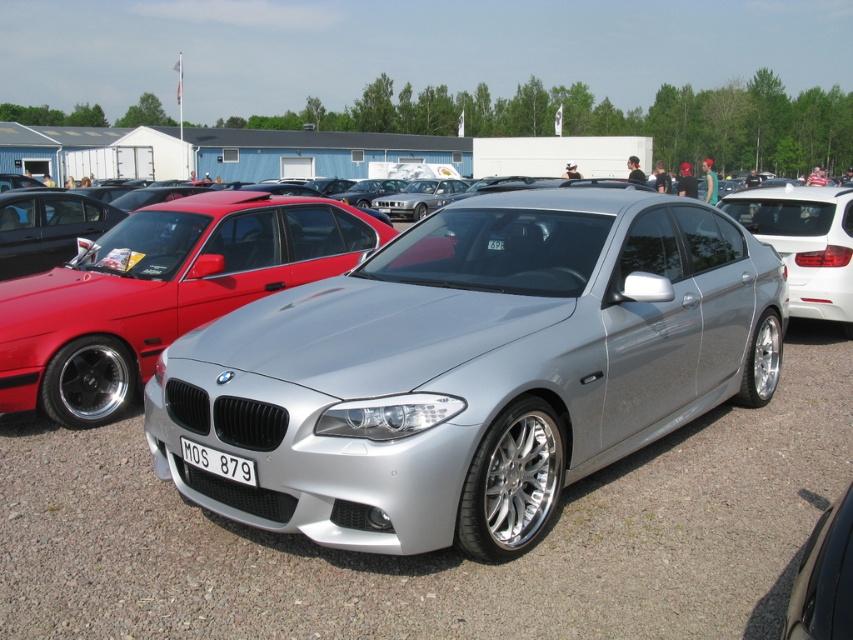
You are a photographer at a car exhibition. You want to capture a photo that shows both the silver metallic car at center and the shiny red sports car at left in the same frame. Considering their sizes, which car should you position closer to the camera to ensure both appear proportionally sized in the image?

The silver metallic car at center is shorter than the shiny red sports car at left. To make them appear proportionally sized, position the silver metallic car at center closer to the camera since it is smaller and needs to be magnified to match the size of the shiny red sports car at left in the photo.

You are standing in front of the silver metallic car at center at a car exhibition. You want to take a photo of the car from a distance that allows you to capture the entire vehicle without any distortion. Considering the car is 4.6 meters long, what is the minimum distance you should stand from the car to achieve this?

To capture the entire 4.6 meter long silver metallic car at center without distortion, you should stand at least 2.99 meters away from it, as that is the distance between the car and the camera according to the description.